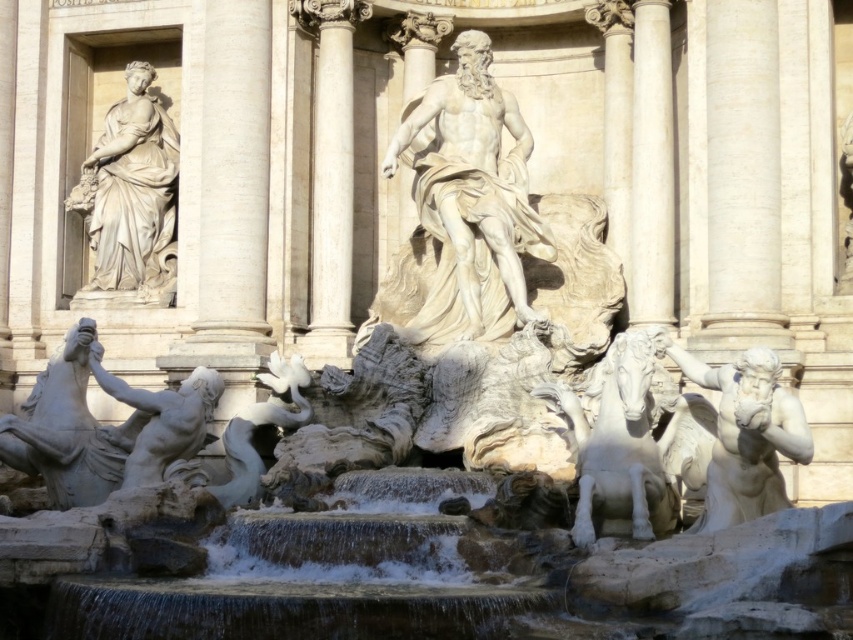
Is point (173, 232) closer to camera compared to point (619, 429)?

No, (173, 232) is behind (619, 429).

Locate an element on the screen. The width and height of the screenshot is (853, 640). white marble statue at upper left is located at coordinates (131, 195).

Does white marble statue at right have a lesser height compared to white marble statue at lower left?

No, white marble statue at right is not shorter than white marble statue at lower left.

How much distance is there between white marble statue at right and white marble statue at lower left?

white marble statue at right is 54.82 feet away from white marble statue at lower left.

Between point (724, 484) and point (181, 454), which one is positioned behind?

The point (181, 454) is behind.

Find the location of a particular element. The width and height of the screenshot is (853, 640). white marble statue at right is located at coordinates (746, 433).

Does point (500, 97) lie in front of point (635, 205)?

No, (500, 97) is behind (635, 205).

Between point (428, 97) and point (645, 321), which one is positioned in front?

Point (645, 321)

What do you see at coordinates (469, 198) in the screenshot? I see `white marble statue at center` at bounding box center [469, 198].

Where is `white marble statue at center`? The image size is (853, 640). white marble statue at center is located at coordinates click(x=469, y=198).